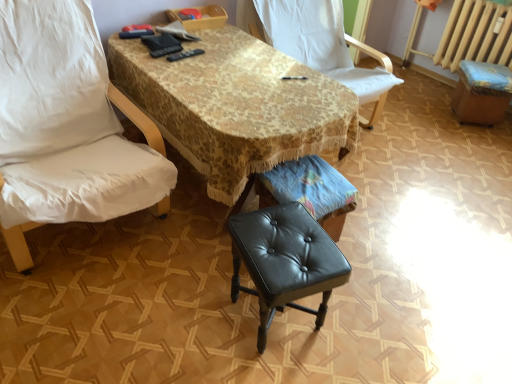
At what (x,y) coordinates should I click in order to perform the action: click on vacant space underneath black leather stool at center (from a real-world perspective). Please return your answer as a coordinate pair (x, y). Looking at the image, I should click on (275, 320).